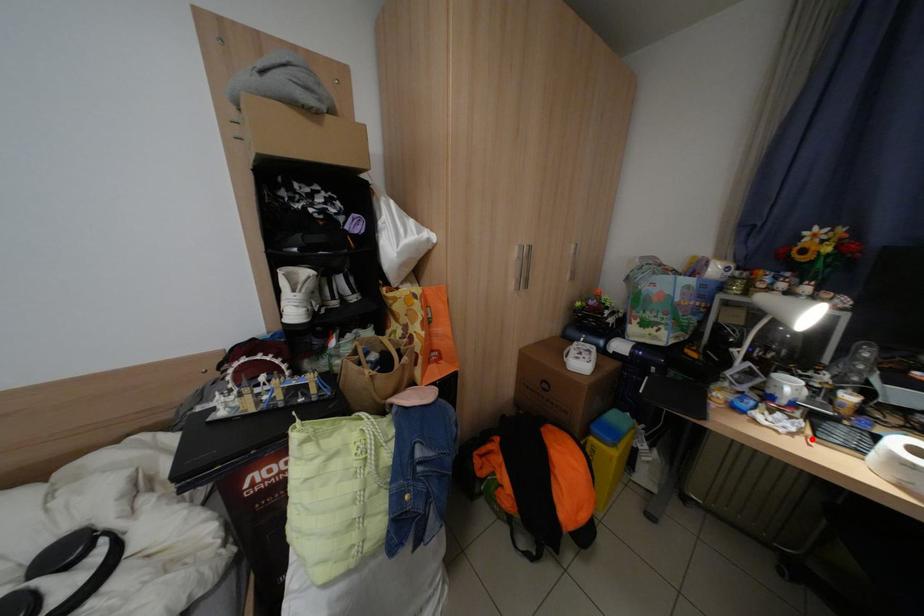
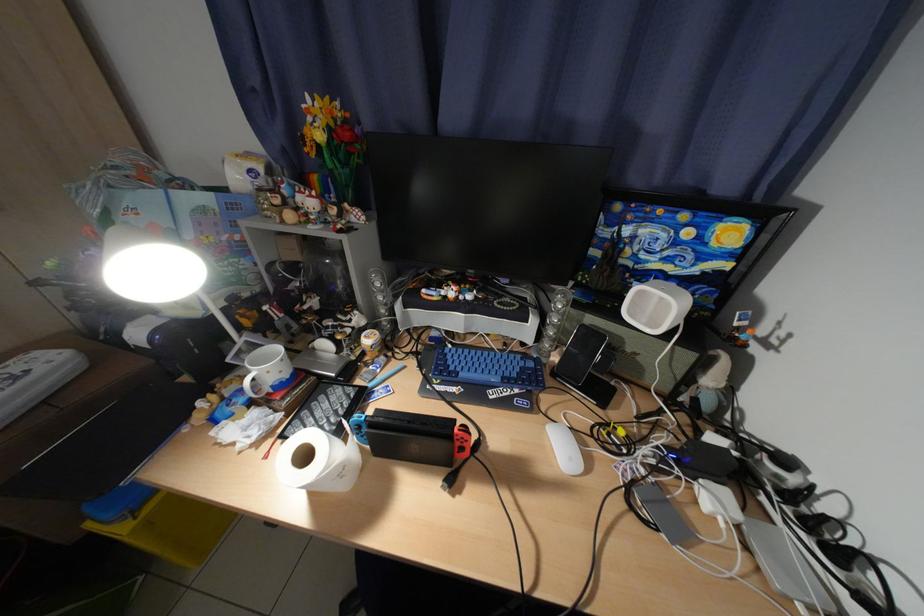
The point at the highlighted location is marked in the first image. Where is the corresponding point in the second image?

(282, 444)